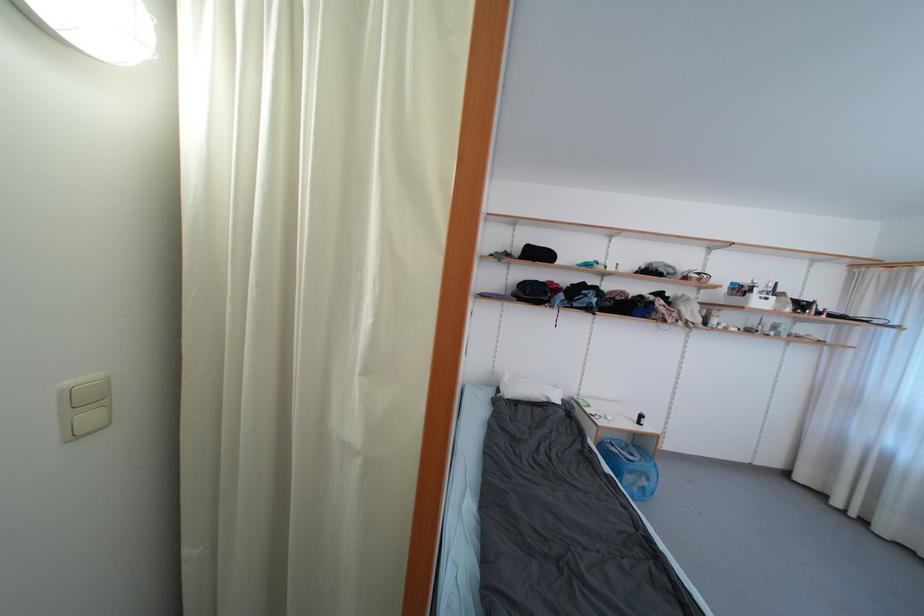
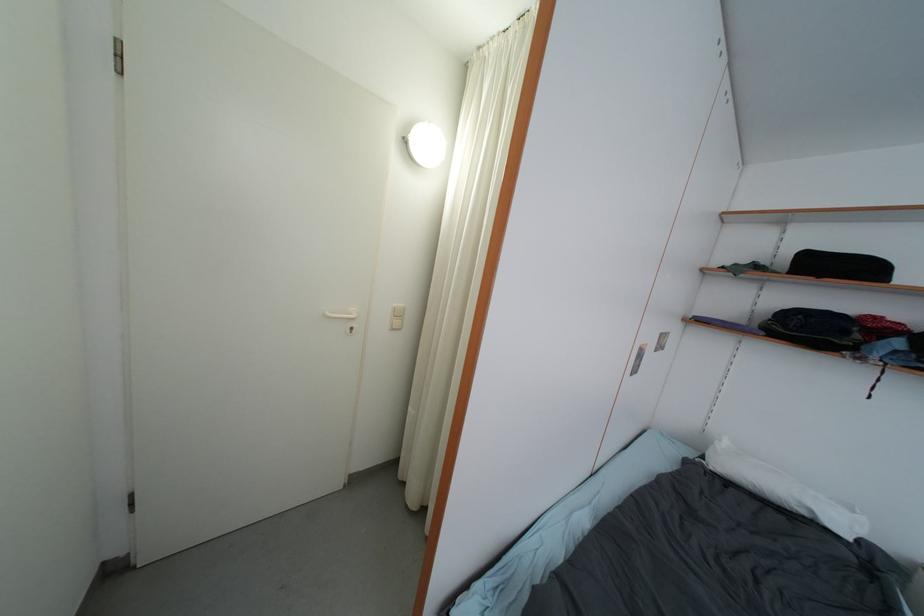
Question: The images are taken continuously from a first-person perspective. In which direction is your viewpoint rotating?

Choices:
 (A) Left
 (B) Right
 (C) Up
 (D) Down

Answer: (A)